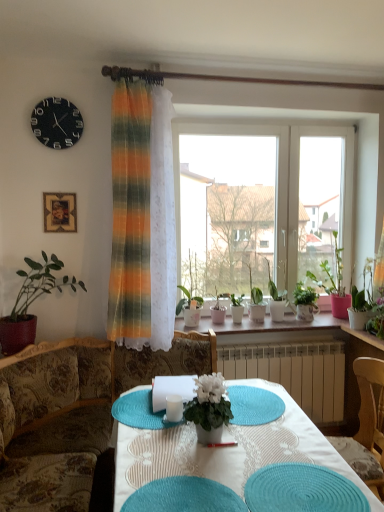
Question: Does teal fabric placemat at lower center have a greater width compared to green matte plant at left, which is counted as the sixth houseplant, starting from the right?

Choices:
 (A) no
 (B) yes

Answer: (B)

Question: Would you consider teal fabric placemat at lower center to be distant from green matte plant at left, which ranks as the 1th houseplant in left-to-right order?

Choices:
 (A) no
 (B) yes

Answer: (B)

Question: Considering the relative positions of teal fabric placemat at lower center and green matte plant at left, the 2th houseplant when ordered from front to back, in the image provided, is teal fabric placemat at lower center to the right of green matte plant at left, the 2th houseplant when ordered from front to back, from the viewer's perspective?

Choices:
 (A) no
 (B) yes

Answer: (B)

Question: Considering the relative sizes of teal fabric placemat at lower center and green matte plant at left, which is counted as the sixth houseplant, starting from the right, in the image provided, is teal fabric placemat at lower center bigger than green matte plant at left, which is counted as the sixth houseplant, starting from the right,?

Choices:
 (A) yes
 (B) no

Answer: (B)

Question: From the image's perspective, would you say teal fabric placemat at lower center is shown under green matte plant at left, which is counted as the sixth houseplant, starting from the right?

Choices:
 (A) no
 (B) yes

Answer: (B)

Question: From a real-world perspective, is green matte plant at left, the 2th houseplant when ordered from front to back, above or below white matte flower pot at center, arranged as the 1th houseplant when viewed from the front?

Choices:
 (A) above
 (B) below

Answer: (A)

Question: Considering their positions, is green matte plant at left, which ranks as the 1th houseplant in left-to-right order, located in front of or behind white matte flower pot at center, the fourth houseplant viewed from the right?

Choices:
 (A) front
 (B) behind

Answer: (B)

Question: In terms of height, does green matte plant at left, the 2th houseplant when ordered from front to back, look taller or shorter compared to white matte flower pot at center, the 6th houseplant when ordered from back to front?

Choices:
 (A) short
 (B) tall

Answer: (B)

Question: From the image's perspective, is green matte plant at left, acting as the fifth houseplant starting from the back, above or below white matte flower pot at center, arranged as the 1th houseplant when viewed from the front?

Choices:
 (A) above
 (B) below

Answer: (A)

Question: Looking at their shapes, would you say teal woven placemat at center is wider or thinner than wooden chair at right, which appears as the 2th chair when viewed from the front?

Choices:
 (A) wide
 (B) thin

Answer: (B)

Question: Is point (208, 506) closer or farther from the camera than point (370, 432)?

Choices:
 (A) closer
 (B) farther

Answer: (A)

Question: Is teal woven placemat at center in front of or behind wooden chair at right, the 1th chair in the back-to-front sequence, in the image?

Choices:
 (A) behind
 (B) front

Answer: (B)

Question: From a real-world perspective, is teal woven placemat at center physically located above or below wooden chair at right, the 1th chair in the back-to-front sequence?

Choices:
 (A) below
 (B) above

Answer: (B)

Question: From their relative heights in the image, would you say teal fabric placemat at lower center is taller or shorter than green glossy plant at right?

Choices:
 (A) tall
 (B) short

Answer: (B)

Question: Looking at their shapes, would you say teal fabric placemat at lower center is wider or thinner than green glossy plant at right?

Choices:
 (A) thin
 (B) wide

Answer: (B)